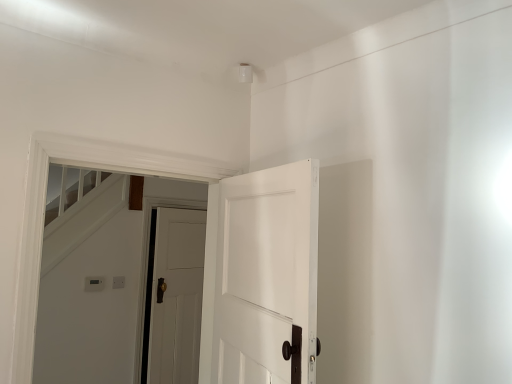
Question: From the image's perspective, is white painted wood door at center, marked as the second door in a back-to-front arrangement, located beneath white wooden door at center, the 1th door when ordered from back to front?

Choices:
 (A) yes
 (B) no

Answer: (B)

Question: Is white painted wood door at center, which is the 2th door from left to right, not inside white wooden door at center, the 2th door in the right-to-left sequence?

Choices:
 (A) no
 (B) yes

Answer: (B)

Question: From a real-world perspective, is white painted wood door at center, which is the 2th door from left to right, on white wooden door at center, the 1th door when ordered from back to front?

Choices:
 (A) yes
 (B) no

Answer: (A)

Question: Considering the relative sizes of white painted wood door at center, marked as the first door in a front-to-back arrangement, and white wooden door at center, the 2th door in the right-to-left sequence, in the image provided, is white painted wood door at center, marked as the first door in a front-to-back arrangement, taller than white wooden door at center, the 2th door in the right-to-left sequence,?

Choices:
 (A) yes
 (B) no

Answer: (B)

Question: Considering the relative sizes of white painted wood door at center, marked as the second door in a back-to-front arrangement, and white wooden door at center, the 1th door when ordered from back to front, in the image provided, is white painted wood door at center, marked as the second door in a back-to-front arrangement, bigger than white wooden door at center, the 1th door when ordered from back to front,?

Choices:
 (A) no
 (B) yes

Answer: (B)

Question: Is white painted wood door at center, marked as the first door in a front-to-back arrangement, surrounding white wooden door at center, the 1th door when ordered from back to front?

Choices:
 (A) yes
 (B) no

Answer: (B)

Question: Is white wooden door at center, which is counted as the second door, starting from the front, in front of white painted wood door at center, positioned as the 1th door in right-to-left order?

Choices:
 (A) no
 (B) yes

Answer: (A)

Question: From a real-world perspective, is white wooden door at center, the 1th door when ordered from left to right, beneath white painted wood door at center, marked as the second door in a back-to-front arrangement?

Choices:
 (A) yes
 (B) no

Answer: (A)

Question: Are white wooden door at center, the 1th door when ordered from back to front, and white painted wood door at center, positioned as the 1th door in right-to-left order, making contact?

Choices:
 (A) no
 (B) yes

Answer: (A)

Question: Could you tell me if white wooden door at center, the 1th door when ordered from left to right, is facing white painted wood door at center, positioned as the 1th door in right-to-left order?

Choices:
 (A) no
 (B) yes

Answer: (A)

Question: Considering the relative sizes of white wooden door at center, the 1th door when ordered from left to right, and white painted wood door at center, positioned as the 1th door in right-to-left order, in the image provided, is white wooden door at center, the 1th door when ordered from left to right, bigger than white painted wood door at center, positioned as the 1th door in right-to-left order,?

Choices:
 (A) no
 (B) yes

Answer: (A)

Question: From the image's perspective, is white wooden door at center, the 1th door when ordered from back to front, beneath white painted wood door at center, marked as the second door in a back-to-front arrangement?

Choices:
 (A) yes
 (B) no

Answer: (A)

Question: In terms of height, does white wooden door at center, the 1th door when ordered from back to front, look taller or shorter compared to white painted wood door at center, which is the 2th door from left to right?

Choices:
 (A) short
 (B) tall

Answer: (B)